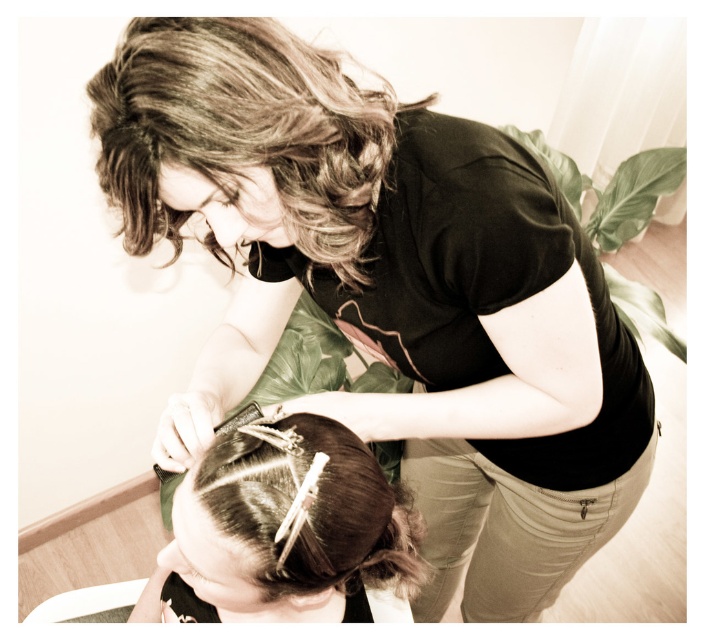
You are a stylist trying to secure the curly brown hair at upper center with the silver metallic hair clip at center. Based on their positions, will the clip be visible from the front once attached?

The curly brown hair at upper center is closer to the viewer than the silver metallic hair clip at center, so when attached, the clip will be positioned behind the hair and thus not visible from the front.

You are a customer in a hair salon looking at the stylist working on your hair. You notice a silver metallic hair clip at center and dark brown silky hair at lower center. Which object is nearer to you?

The silver metallic hair clip at center is closer to the viewer than dark brown silky hair at lower center.

You are a stylist trying to secure the curly brown hair at upper center with the silver metallic hair clip at center. Based on their sizes, will the clip be able to hold the hair effectively?

The curly brown hair at upper center is wider than the silver metallic hair clip at center, so the clip may not be able to hold the hair effectively due to its smaller size.